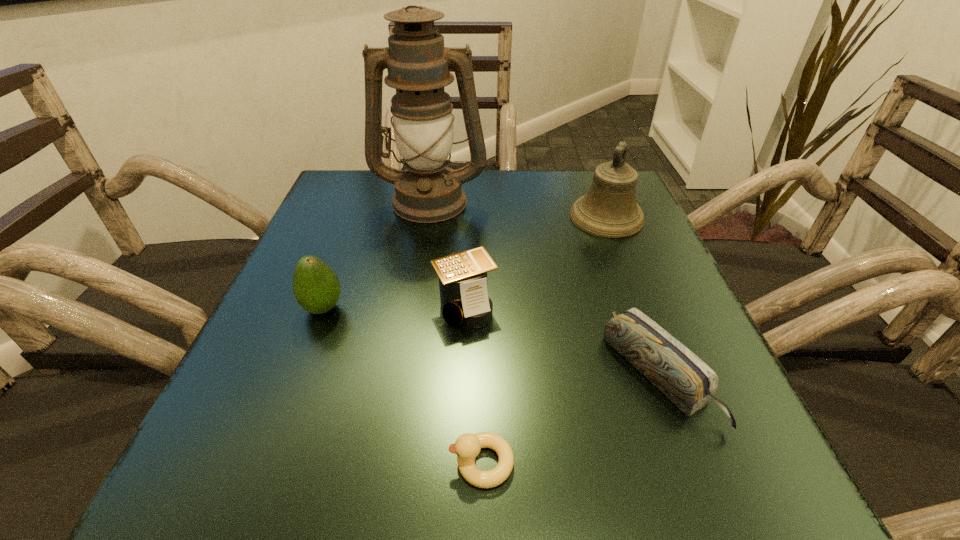
At what (x,y) coordinates should I click in order to perform the action: click on vacant region that satisfies the following two spatial constraints: 1. on the front side of the pencil box; 2. at the beak of the shortest object. Please return your answer as a coordinate pair (x, y). This screenshot has width=960, height=540. Looking at the image, I should click on (690, 463).

This screenshot has height=540, width=960. I want to click on vacant space that satisfies the following two spatial constraints: 1. on the front side of the fifth shortest object; 2. at the beak of the duckling, so click(703, 463).

Find the location of a particular element. Image resolution: width=960 pixels, height=540 pixels. free location that satisfies the following two spatial constraints: 1. on the back side of the calculator; 2. on the left side of the fourth shortest object is located at coordinates (324, 306).

Where is `free spot that satisfies the following two spatial constraints: 1. on the back side of the oil lamp; 2. on the right side of the avocado`? This screenshot has height=540, width=960. free spot that satisfies the following two spatial constraints: 1. on the back side of the oil lamp; 2. on the right side of the avocado is located at coordinates (364, 200).